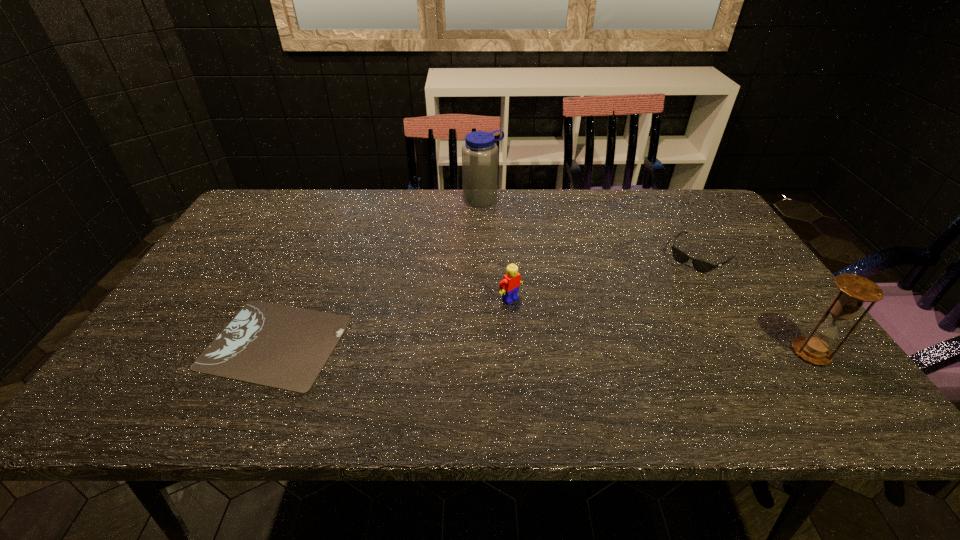
Locate an element on the screen. This screenshot has height=540, width=960. vacant space on the desktop that is between the shortest object and the hourglass and is positioned on the front-facing side of the fourth tallest object is located at coordinates (606, 349).

The image size is (960, 540). Find the location of `free space on the desktop that is between the leftmost object and the hourglass and is positioned with a carrying loop on the side of the water bottle`. free space on the desktop that is between the leftmost object and the hourglass and is positioned with a carrying loop on the side of the water bottle is located at coordinates (620, 349).

Where is `free spot on the desktop that is between the leftmost object and the hourglass and is positioned on the front-facing side of the third shortest object`? free spot on the desktop that is between the leftmost object and the hourglass and is positioned on the front-facing side of the third shortest object is located at coordinates (568, 348).